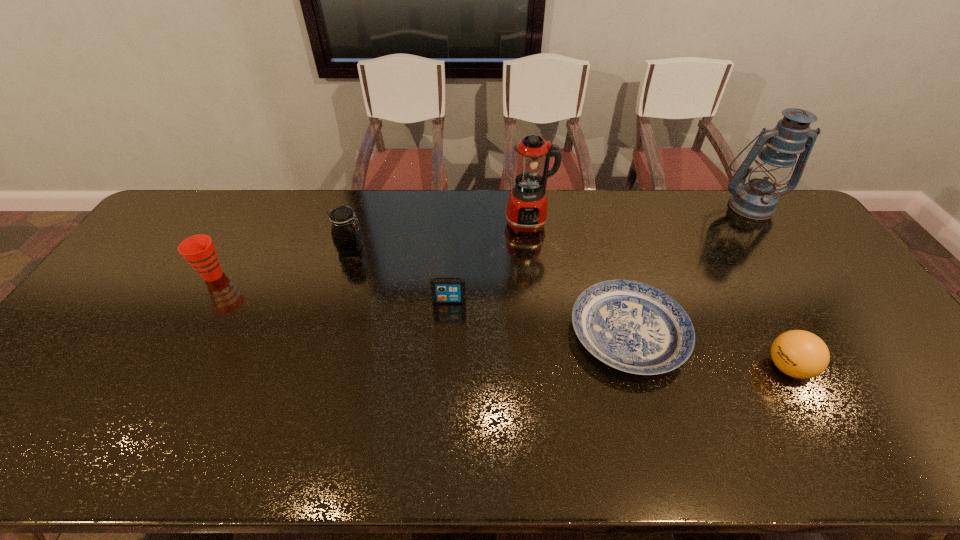
Locate an element on the screen. lantern is located at coordinates (757, 199).

Identify the location of food processor. (527, 207).

Identify the location of the fifth nearest object. (346, 233).

Locate an element on the screen. The height and width of the screenshot is (540, 960). the second object from left to right is located at coordinates (346, 233).

Identify the location of cup. click(x=199, y=250).

The height and width of the screenshot is (540, 960). In order to click on the fourth nearest object in this screenshot , I will do `click(199, 250)`.

Locate an element on the screen. The width and height of the screenshot is (960, 540). the second object from right to left is located at coordinates (801, 354).

The width and height of the screenshot is (960, 540). I want to click on the third object from left to right, so click(443, 290).

The height and width of the screenshot is (540, 960). I want to click on the sixth tallest object, so click(x=443, y=290).

Locate an element on the screen. The width and height of the screenshot is (960, 540). the shortest object is located at coordinates (631, 326).